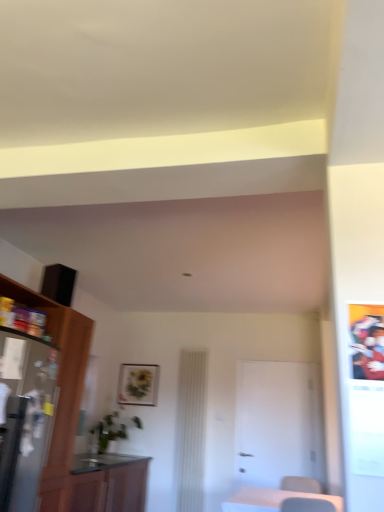
This screenshot has height=512, width=384. What do you see at coordinates (108, 483) in the screenshot? I see `wooden cabinet at lower left, positioned as the first cabinetry in bottom-to-top order` at bounding box center [108, 483].

Looking at this image, what is the approximate width of wooden cabinet at left, marked as the 1th cabinetry in a top-to-bottom arrangement?

It is 72.58 centimeters.

What do you see at coordinates (60, 385) in the screenshot? I see `wooden cabinet at left, placed as the 2th cabinetry when sorted from bottom to top` at bounding box center [60, 385].

Describe the element at coordinates (278, 423) in the screenshot. This screenshot has height=512, width=384. I see `white matte door at center` at that location.

You are a GUI agent. You are given a task and a screenshot of the screen. Output one action in this format:
    pyautogui.click(x=<x>, y=<y>)
    Task: Click on the matte black picture frame at center
    Image resolution: width=384 pixels, height=512 pixels.
    Given the screenshot: What is the action you would take?
    pyautogui.click(x=138, y=384)

Can you confirm if metallic silver refrigerator at left is shorter than wooden table at lower right?

No, metallic silver refrigerator at left is not shorter than wooden table at lower right.

Based on their sizes in the image, would you say metallic silver refrigerator at left is bigger or smaller than wooden table at lower right?

Clearly, metallic silver refrigerator at left is larger in size than wooden table at lower right.

Consider the image. Is metallic silver refrigerator at left completely or partially outside of wooden table at lower right?

metallic silver refrigerator at left lies outside wooden table at lower right's area.

Locate an element on the screen. door positioned vertically above the wooden table at lower right (from a real-world perspective) is located at coordinates (278, 423).

Are wooden table at lower right and white matte door at center far apart?

wooden table at lower right is far away from white matte door at center.

In the image, is wooden table at lower right positioned in front of or behind white matte door at center?

Clearly, wooden table at lower right is in front of white matte door at center.

How many degrees apart are the facing directions of wooden table at lower right and white matte door at center?

The angle between the facing direction of wooden table at lower right and the facing direction of white matte door at center is 0.305 degrees.

From their relative heights in the image, would you say matte black picture frame at center is taller or shorter than wooden table at lower right?

matte black picture frame at center is taller than wooden table at lower right.

Could you tell me if matte black picture frame at center is facing wooden table at lower right?

No, matte black picture frame at center is not oriented towards wooden table at lower right.

Is matte black picture frame at center thinner than wooden table at lower right?

Yes.

Is matte black picture frame at center with wooden table at lower right?

matte black picture frame at center and wooden table at lower right are not in contact.

How far apart are white matte door at center and metallic silver refrigerator at left?

white matte door at center is 3.31 meters from metallic silver refrigerator at left.

Are white matte door at center and metallic silver refrigerator at left beside each other?

white matte door at center and metallic silver refrigerator at left are clearly separated.

This screenshot has width=384, height=512. I want to click on door on the right of the metallic silver refrigerator at left, so click(278, 423).

The image size is (384, 512). What are the coordinates of `table below the metallic silver refrigerator at left (from a real-world perspective)` in the screenshot? It's located at (272, 500).

Is the surface of wooden table at lower right in direct contact with metallic silver refrigerator at left?

No, wooden table at lower right is not making contact with metallic silver refrigerator at left.

Can you confirm if wooden table at lower right is smaller than metallic silver refrigerator at left?

Yes.

Which object is more forward, wooden table at lower right or metallic silver refrigerator at left?

Positioned in front is metallic silver refrigerator at left.

From a real-world perspective, is wooden cabinet at left, placed as the 2th cabinetry when sorted from bottom to top, above or below white matte door at center?

wooden cabinet at left, placed as the 2th cabinetry when sorted from bottom to top, is above white matte door at center.

Is wooden cabinet at left, placed as the 2th cabinetry when sorted from bottom to top, in contact with white matte door at center?

There is a gap between wooden cabinet at left, placed as the 2th cabinetry when sorted from bottom to top, and white matte door at center.

Considering the points (66, 308) and (299, 435), which point is behind, point (66, 308) or point (299, 435)?

The point (299, 435) is farther.

Starting from the white matte door at center, which cabinetry is the 2nd one to the left? Please provide its 2D coordinates.

[(60, 385)]

The width and height of the screenshot is (384, 512). Identify the location of cabinetry that is the 1st one below the matte black picture frame at center (from a real-world perspective). (60, 385).

Is matte black picture frame at center not close to wooden cabinet at left, placed as the 2th cabinetry when sorted from bottom to top?

matte black picture frame at center is positioned a significant distance from wooden cabinet at left, placed as the 2th cabinetry when sorted from bottom to top.

Can you tell me how much matte black picture frame at center and wooden cabinet at left, marked as the 1th cabinetry in a top-to-bottom arrangement, differ in facing direction?

matte black picture frame at center and wooden cabinet at left, marked as the 1th cabinetry in a top-to-bottom arrangement, are facing 89.4 degrees away from each other.

Could you measure the distance between matte black picture frame at center and wooden cabinet at left, marked as the 1th cabinetry in a top-to-bottom arrangement?

matte black picture frame at center is 8.01 feet from wooden cabinet at left, marked as the 1th cabinetry in a top-to-bottom arrangement.

Identify the location of table that is behind the metallic silver refrigerator at left. The image size is (384, 512). (272, 500).

I want to click on table that is on the left side of white matte door at center, so click(272, 500).

Based on the photo, which object lies nearer to the anchor point matte black picture frame at center, white matte door at center or wooden cabinet at lower left, positioned as the first cabinetry in bottom-to-top order?

The object closer to matte black picture frame at center is wooden cabinet at lower left, positioned as the first cabinetry in bottom-to-top order.

Estimate the real-world distances between objects in this image. Which object is closer to wooden cabinet at left, placed as the 2th cabinetry when sorted from bottom to top, matte black picture frame at center or white matte door at center?

matte black picture frame at center lies closer to wooden cabinet at left, placed as the 2th cabinetry when sorted from bottom to top, than the other object.

When comparing their distances from white matte door at center, does metallic silver refrigerator at left or matte black picture frame at center seem closer?

The object closer to white matte door at center is matte black picture frame at center.

When comparing their distances from wooden cabinet at lower left, which is counted as the 2th cabinetry, starting from the top, does matte black picture frame at center or metallic silver refrigerator at left seem closer?

metallic silver refrigerator at left.

Which object lies further to the anchor point metallic silver refrigerator at left, white matte door at center or wooden cabinet at left, marked as the 1th cabinetry in a top-to-bottom arrangement?

white matte door at center is further to metallic silver refrigerator at left.

When comparing their distances from matte black picture frame at center, does white matte door at center or metallic silver refrigerator at left seem closer?

white matte door at center is positioned closer to the anchor matte black picture frame at center.

When comparing their distances from matte black picture frame at center, does wooden table at lower right or wooden cabinet at lower left, which is counted as the 2th cabinetry, starting from the top, seem further?

wooden table at lower right lies further to matte black picture frame at center than the other object.

When comparing their distances from metallic silver refrigerator at left, does wooden cabinet at left, placed as the 2th cabinetry when sorted from bottom to top, or matte black picture frame at center seem closer?

wooden cabinet at left, placed as the 2th cabinetry when sorted from bottom to top, is closer to metallic silver refrigerator at left.

You are a GUI agent. You are given a task and a screenshot of the screen. Output one action in this format:
    pyautogui.click(x=<x>, y=<y>)
    Task: Click on the appliance between wooden cabinet at left, marked as the 1th cabinetry in a top-to-bottom arrangement, and wooden table at lower right from left to right
    
    Given the screenshot: What is the action you would take?
    pyautogui.click(x=24, y=416)

The image size is (384, 512). Find the location of `cabinetry between metallic silver refrigerator at left and wooden table at lower right in the horizontal direction`. cabinetry between metallic silver refrigerator at left and wooden table at lower right in the horizontal direction is located at coordinates (108, 483).

You are a GUI agent. You are given a task and a screenshot of the screen. Output one action in this format:
    pyautogui.click(x=<x>, y=<y>)
    Task: Click on the appliance between wooden cabinet at left, placed as the 2th cabinetry when sorted from bottom to top, and matte black picture frame at center in the front-back direction
    
    Given the screenshot: What is the action you would take?
    pyautogui.click(x=24, y=416)

This screenshot has height=512, width=384. In order to click on cabinetry positioned between wooden table at lower right and matte black picture frame at center from near to far in this screenshot , I will do `click(108, 483)`.